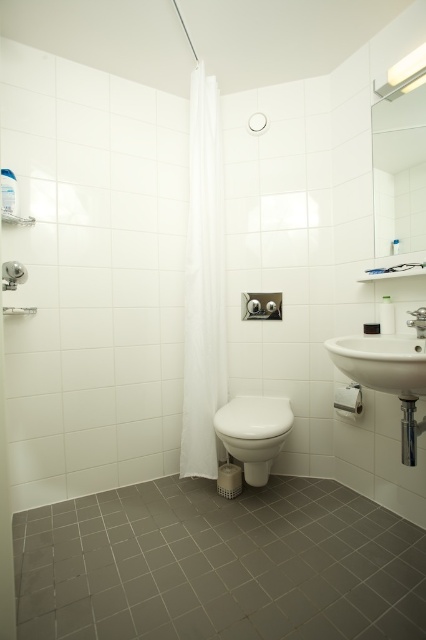
You are standing in the bathroom and want to adjust the shower curtain. You see the white sheer curtain at center and the matte silver faucet at upper right. Which one is positioned to the left of the other?

The white sheer curtain at center is positioned to the left of the matte silver faucet at upper right.

You are designing a bathroom layout and need to place a decorative shelf between the white sheer curtain at center and the white ceramic sink at right. Which object should the shelf be placed closer to if it needs to be closer to the narrower object?

The shelf should be placed closer to the white sheer curtain at center because it has a lesser width compared to the white ceramic sink at right.

You are a home decorator planning to hang a new picture frame in this bathroom. The frame is 1 meter wide. You want to place it between the white sheer curtain at center and the matte silver faucet at upper right. Considering their sizes, will there be enough space for the frame?

The white sheer curtain at center has a larger size compared to matte silver faucet at upper right. Since the frame is 1 meter wide, there may be sufficient space between them if the distance between the two objects is at least 1 meter. However, the exact spacing isn